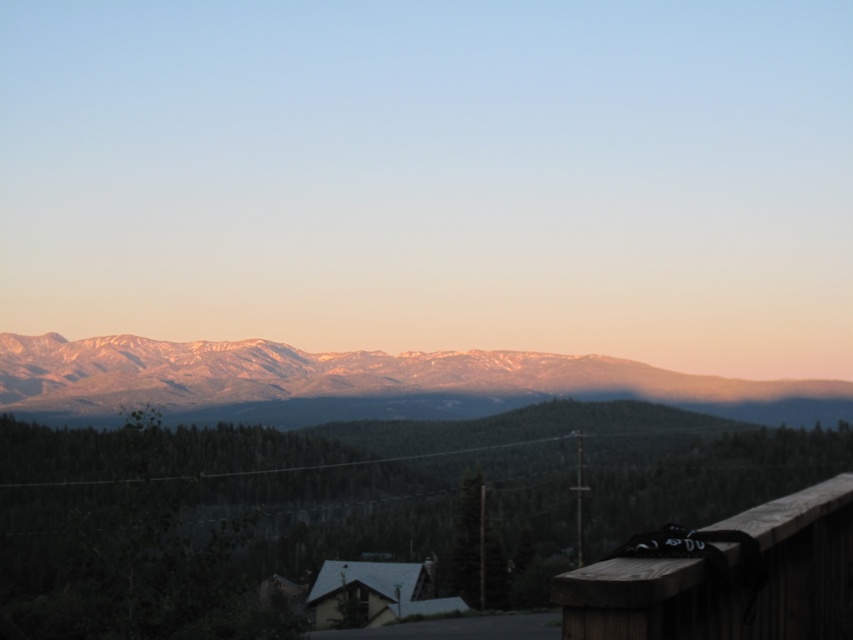
From the picture: Based on the scene description, where is the point located at coordinates (358,381)?

The point at coordinates (358,381) corresponds to the snowy mountain range at upper center.

You are standing at the lower right corner of the image where the wooden rail at lower right is located. Looking towards the snowy mountain range at upper center, how does the size of the mountain range compare to the wooden rail?

The snowy mountain range at upper center has a larger size compared to the wooden rail at lower right, so the mountains appear much bigger than the wooden rail.